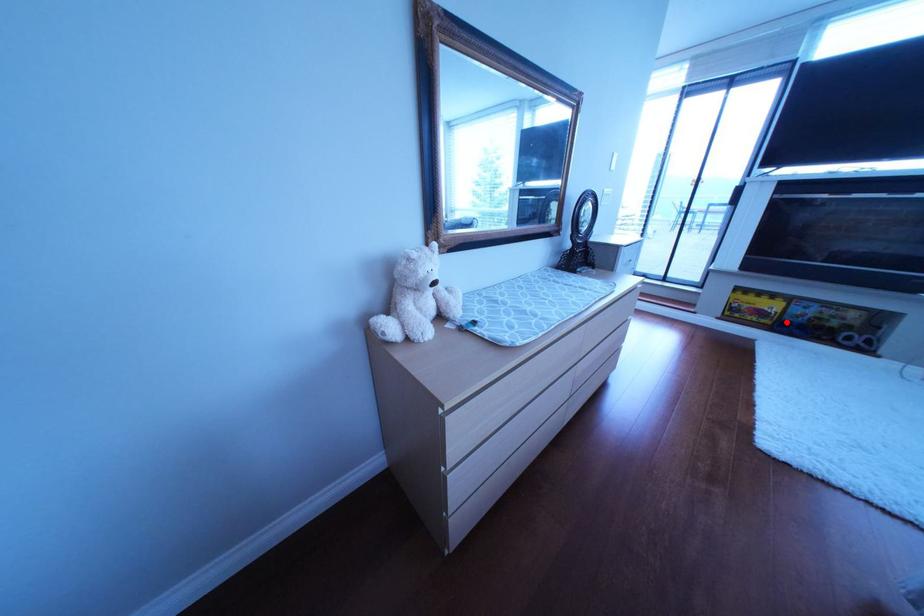
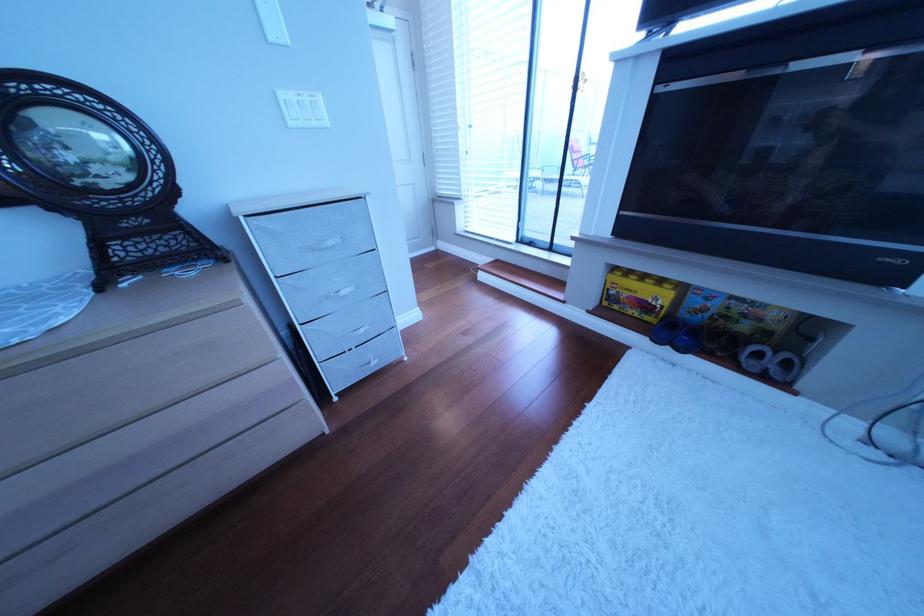
Locate, in the second image, the point that corresponds to the highlighted location in the first image.

(672, 320)